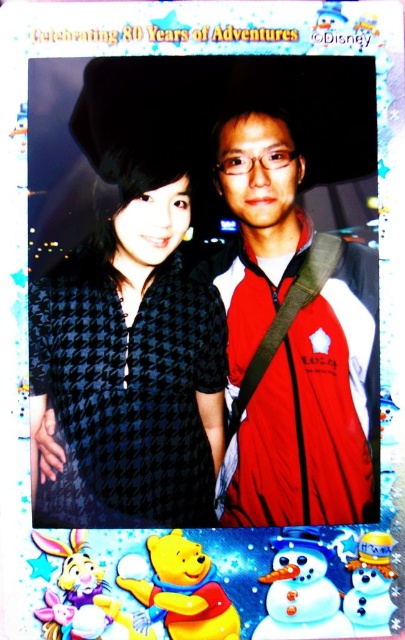
Question: Is snow white snowman at lower center bigger than white matte snowman at center?

Choices:
 (A) no
 (B) yes

Answer: (B)

Question: Observing the image, what is the correct spatial positioning of red matte jacket at right in reference to snow white snowman at lower center?

Choices:
 (A) left
 (B) right

Answer: (B)

Question: Among these objects, which one is nearest to the camera?

Choices:
 (A) snow white snowman at lower center
 (B) white frosty snowman at lower right
 (C) black houndstooth dress at center
 (D) red matte jacket at right

Answer: (B)

Question: Estimate the real-world distances between objects in this image. Which object is farther from the red matte jacket at right?

Choices:
 (A) white matte snowman at center
 (B) snow white snowman at lower center

Answer: (B)

Question: Which of the following is the farthest from the observer?

Choices:
 (A) (358, 576)
 (B) (121, 588)
 (C) (257, 632)
 (D) (326, 412)

Answer: (D)

Question: Can you confirm if black houndstooth dress at center is thinner than white matte snowman at center?

Choices:
 (A) no
 (B) yes

Answer: (A)